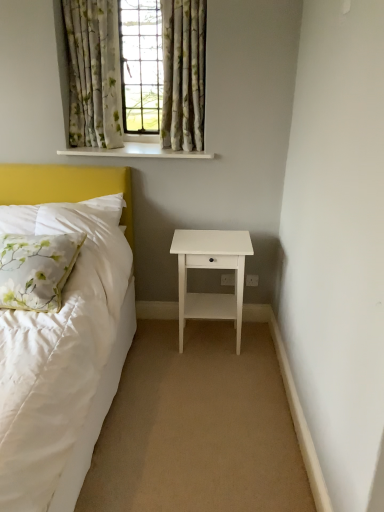
Find the location of a particular element. vacant point above beige carpet at lower center (from a real-world perspective) is located at coordinates (197, 388).